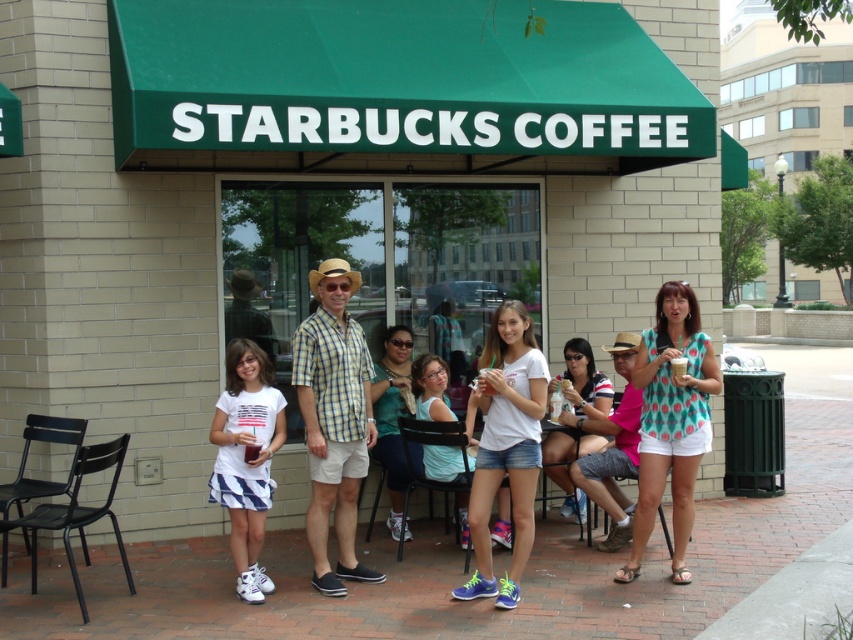
Question: Is white cotton t-shirt at center thinner than teal fabric shirt at center?

Choices:
 (A) yes
 (B) no

Answer: (B)

Question: Which point is closer to the camera?

Choices:
 (A) polka dot blouse at center
 (B) teal fabric shirt at center
 (C) yellow plaid shirt at center
 (D) white matte t-shirt at center

Answer: (D)

Question: Which point is farther to the camera?

Choices:
 (A) (248, 397)
 (B) (387, 364)

Answer: (B)

Question: Can you confirm if polka dot blouse at center is positioned to the left of white matte t-shirt at center?

Choices:
 (A) yes
 (B) no

Answer: (B)

Question: Which object appears closest to the camera in this image?

Choices:
 (A) teal fabric shirt at center
 (B) matte black sunglasses at center
 (C) polka dot blouse at center

Answer: (C)

Question: From the image, what is the correct spatial relationship of polka dot blouse at center in relation to matte black sunglasses at center?

Choices:
 (A) above
 (B) below

Answer: (A)